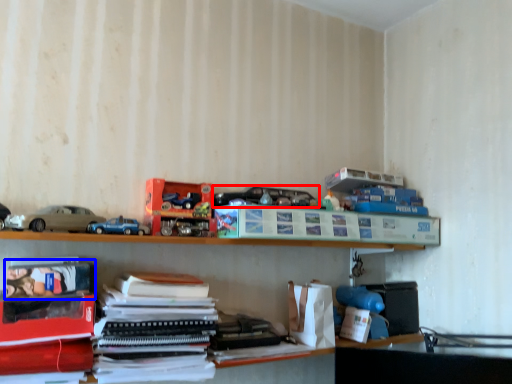
Question: Which object is closer to the camera taking this photo, toy (highlighted by a red box) or book (highlighted by a blue box)?

Choices:
 (A) toy
 (B) book

Answer: (B)